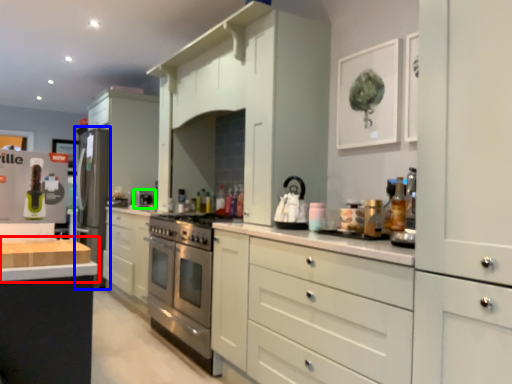
Question: Estimate the real-world distances between objects in this image. Which object is farther from countertop (highlighted by a red box), appliance (highlighted by a blue box) or appliance (highlighted by a green box)?

Choices:
 (A) appliance
 (B) appliance

Answer: (A)